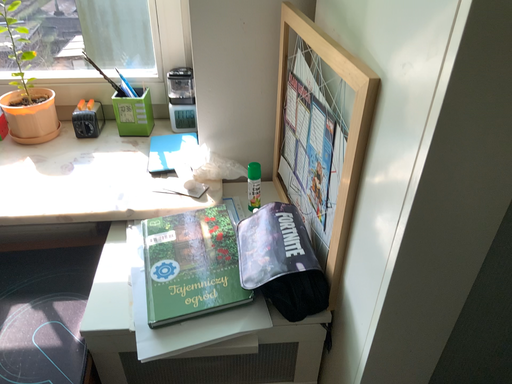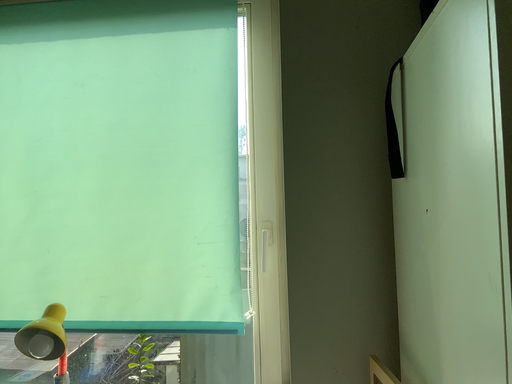
Question: How did the camera likely rotate when shooting the video?

Choices:
 (A) rotated upward
 (B) rotated downward

Answer: (A)